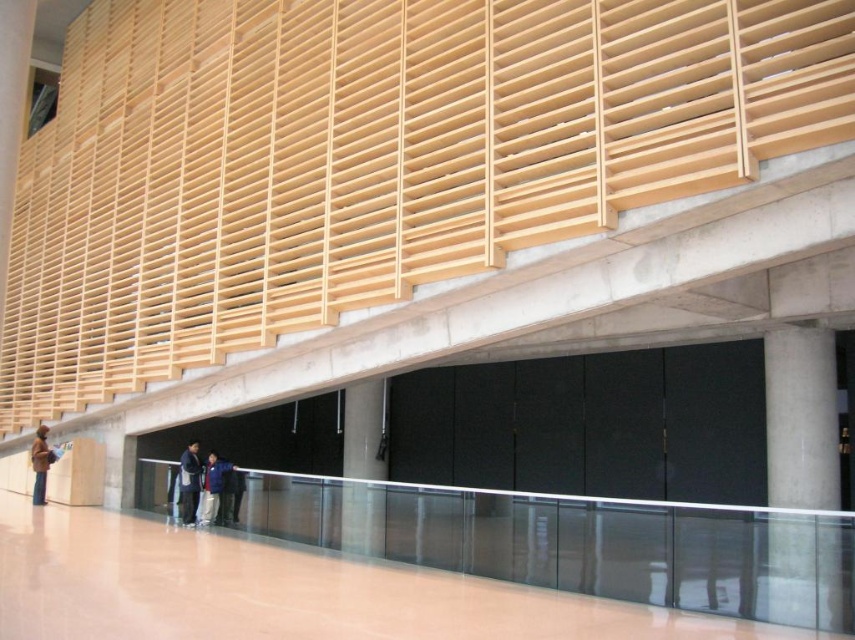
You are standing in the modern interior space described. You need to locate the dark blue jacket at center. According to the coordinates provided, where exactly would you find it?

The dark blue jacket at center is located at point coordinates of 0.755 on the x axis and 0.222 on the y axis.

You are standing in the interior space and want to know the exact location of the clear glass balustrade at lower center. According to the coordinates provided, where is it located?

The clear glass balustrade at lower center is located at point (635,548).

Consider the image. You are standing in the modern interior space and see the dark blue jacket at center and the blue fabric jacket at lower center. Which jacket is closer to you?

The dark blue jacket at center is closer to you because it is further to the viewer than the blue fabric jacket at lower center.